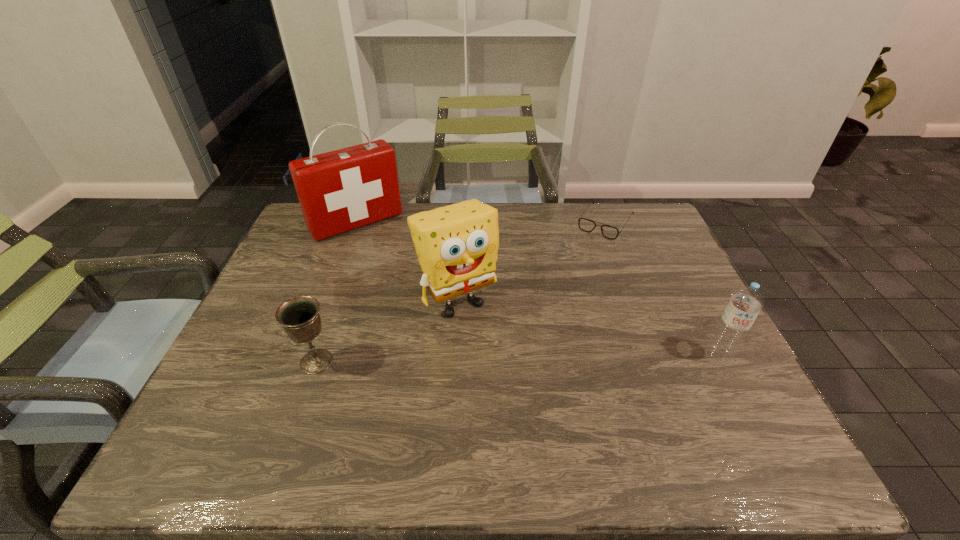
This screenshot has height=540, width=960. I want to click on the first-aid kit situated at the far edge, so click(341, 190).

Find the location of `object present at the left edge`. object present at the left edge is located at coordinates (341, 190).

At what (x,y) coordinates should I click in order to perform the action: click on water bottle located at the right edge. Please return your answer as a coordinate pair (x, y). Looking at the image, I should click on (745, 304).

You are a GUI agent. You are given a task and a screenshot of the screen. Output one action in this format:
    pyautogui.click(x=<x>, y=<y>)
    Task: Click on the sunglasses situated at the right edge
    The height and width of the screenshot is (540, 960).
    Given the screenshot: What is the action you would take?
    pyautogui.click(x=587, y=225)

I want to click on object positioned at the far left corner, so click(x=341, y=190).

Identify the location of object situated at the far right corner. The height and width of the screenshot is (540, 960). (587, 225).

In the image, there is a desktop. Where is `vacant space at the far edge`? The height and width of the screenshot is (540, 960). vacant space at the far edge is located at coordinates (494, 206).

Locate an element on the screen. vacant space at the near edge of the desktop is located at coordinates (637, 411).

Identify the location of free point at the left edge. Image resolution: width=960 pixels, height=540 pixels. (236, 376).

Locate an element on the screen. vacant space at the right edge of the desktop is located at coordinates (670, 334).